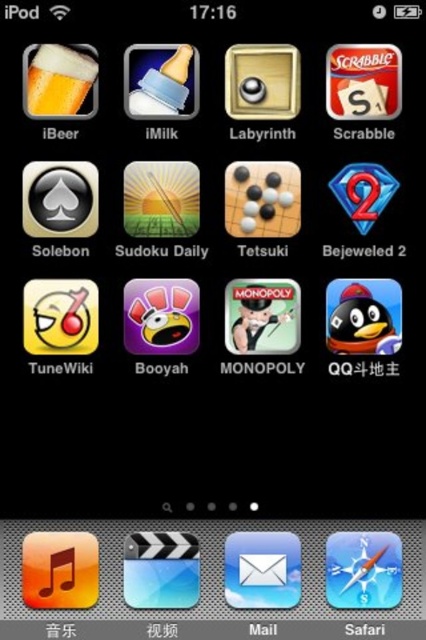
The height and width of the screenshot is (640, 426). What are the coordinates of `white glossy envelope at center` in the screenshot? It's located at (261, 570).

Does point (284, 596) lie in front of point (54, 61)?

Yes, it is.

The image size is (426, 640). Identify the location of white glossy envelope at center. (261, 570).